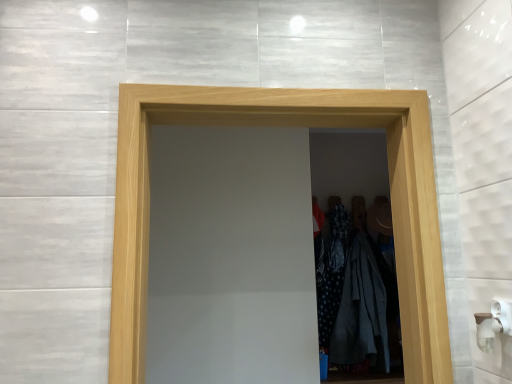
Question: From a real-world perspective, is wooden door at center physically above dark gray fabric coat at center?

Choices:
 (A) yes
 (B) no

Answer: (A)

Question: Is wooden door at center bigger than dark gray fabric coat at center?

Choices:
 (A) no
 (B) yes

Answer: (B)

Question: Is wooden door at center at the left side of dark gray fabric coat at center?

Choices:
 (A) no
 (B) yes

Answer: (B)

Question: Does wooden door at center have a smaller size compared to dark gray fabric coat at center?

Choices:
 (A) yes
 (B) no

Answer: (B)

Question: From a real-world perspective, is wooden door at center beneath dark gray fabric coat at center?

Choices:
 (A) yes
 (B) no

Answer: (B)

Question: Can you confirm if wooden door at center is shorter than dark gray fabric coat at center?

Choices:
 (A) yes
 (B) no

Answer: (B)

Question: Is dark gray fabric coat at center outside wooden door at center?

Choices:
 (A) no
 (B) yes

Answer: (B)

Question: Would you consider dark gray fabric coat at center to be distant from wooden door at center?

Choices:
 (A) yes
 (B) no

Answer: (A)

Question: Can you confirm if dark gray fabric coat at center is taller than wooden door at center?

Choices:
 (A) yes
 (B) no

Answer: (B)

Question: Is dark gray fabric coat at center thinner than wooden door at center?

Choices:
 (A) no
 (B) yes

Answer: (B)

Question: Can you confirm if dark gray fabric coat at center is smaller than wooden door at center?

Choices:
 (A) no
 (B) yes

Answer: (B)

Question: Are dark gray fabric coat at center and wooden door at center beside each other?

Choices:
 (A) yes
 (B) no

Answer: (B)

Question: From a real-world perspective, relative to dark gray fabric coat at center, is wooden door at center vertically above or below?

Choices:
 (A) below
 (B) above

Answer: (B)